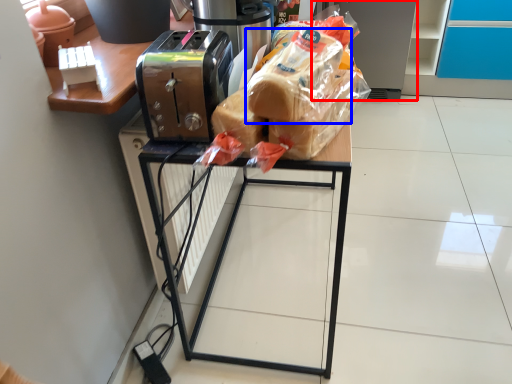
Question: Which of the following is the farthest to the observer, appliance (highlighted by a red box) or bread (highlighted by a blue box)?

Choices:
 (A) appliance
 (B) bread

Answer: (A)